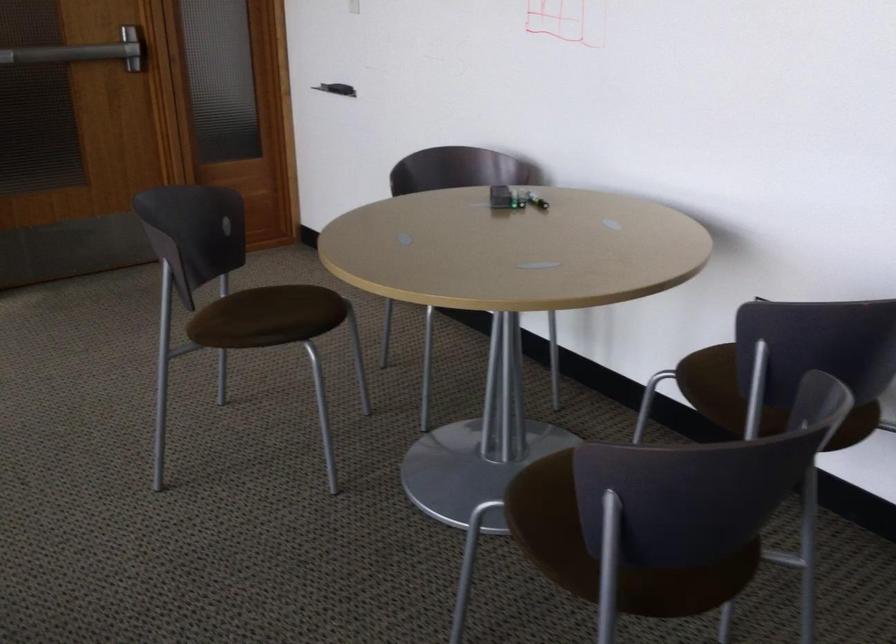
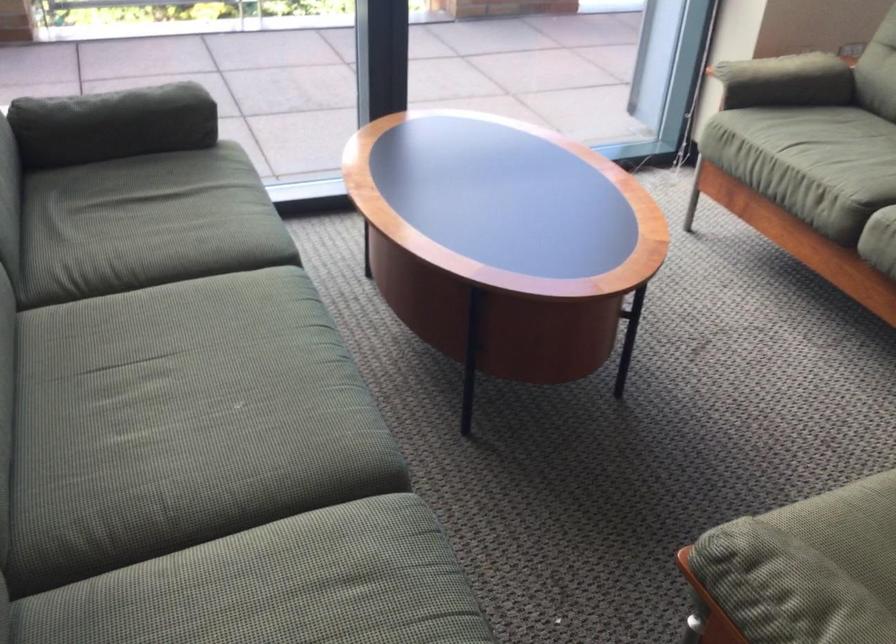
The images are taken continuously from a first-person perspective. In which direction is your viewpoint rotating?

The rotation direction of the camera is left-down.